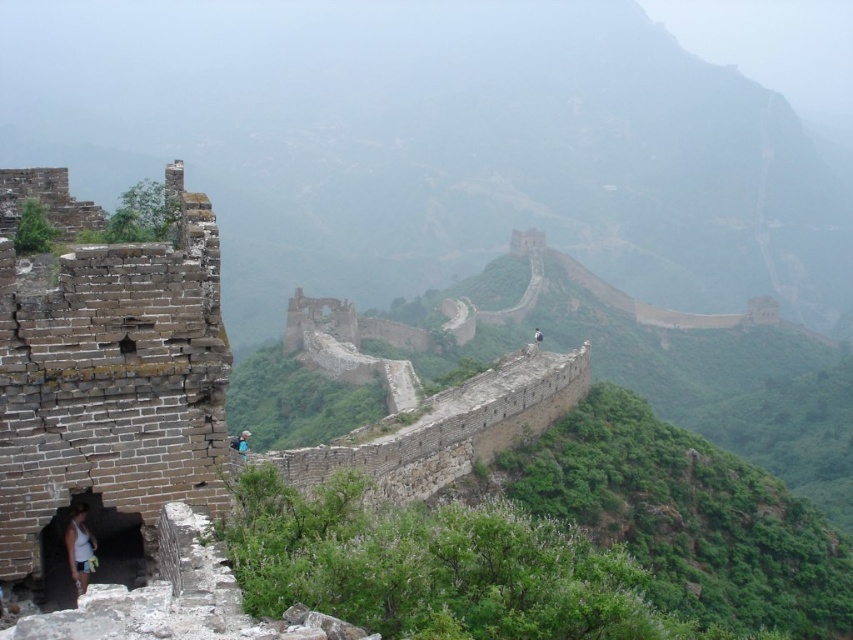
You are standing on the Great Wall of China and see the foggy stone wall at center. Can you determine its exact location using coordinates?

The foggy stone wall at center is located at coordinates point (x=436, y=145).

You are standing on the Great Wall of China and want to take a photo of the foggy stone wall at center. According to the coordinates provided, where should you aim your camera?

You should aim your camera at point (436, 145) to capture the foggy stone wall at center.